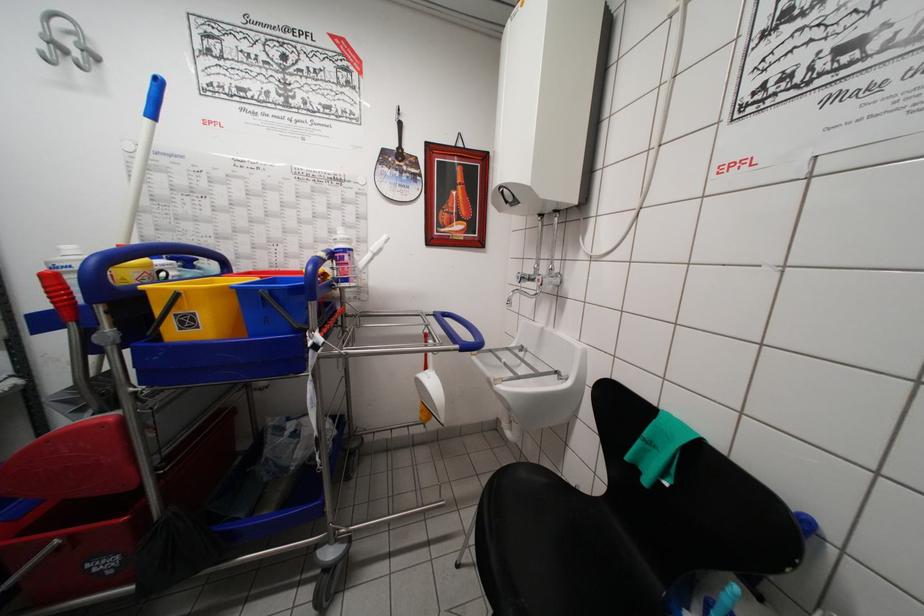
What do you see at coordinates (70, 333) in the screenshot? The image size is (924, 616). I see `the red lever handle` at bounding box center [70, 333].